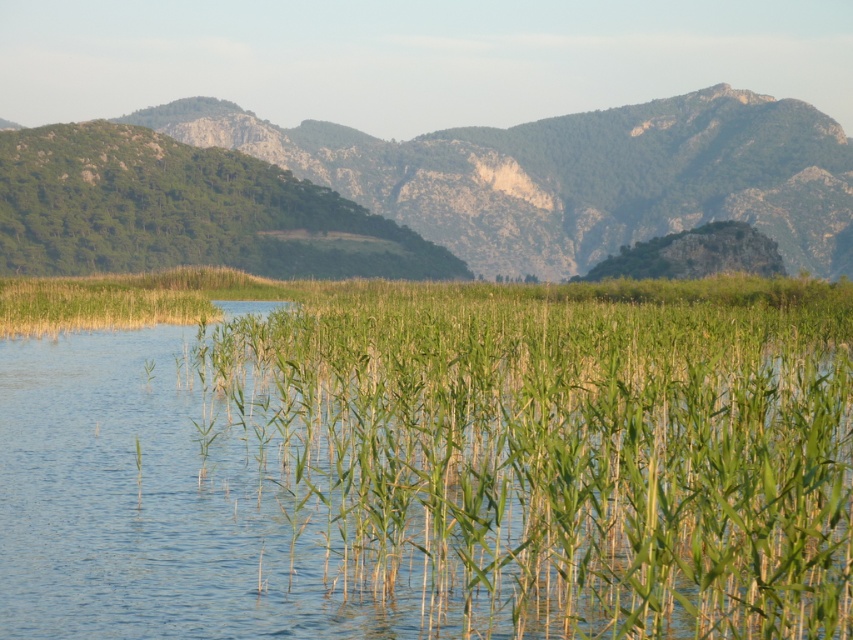
Question: Can you confirm if green leafy grass at center is positioned to the left of green textured grass at upper center?

Choices:
 (A) yes
 (B) no

Answer: (A)

Question: Observing the image, what is the correct spatial positioning of green leafy grass at center in reference to green textured grass at upper center?

Choices:
 (A) right
 (B) left

Answer: (B)

Question: Which point appears closest to the camera in this image?

Choices:
 (A) click(x=281, y=449)
 (B) click(x=590, y=116)

Answer: (A)

Question: Which object is closer to the camera taking this photo?

Choices:
 (A) green leafy grass at center
 (B) green textured grass at upper center

Answer: (A)

Question: Can you confirm if green leafy grass at center is positioned above green textured grass at upper center?

Choices:
 (A) yes
 (B) no

Answer: (B)